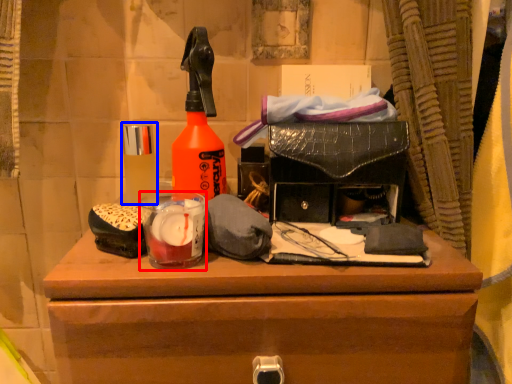
Question: Among these objects, which one is nearest to the camera, beverage (highlighted by a red box) or toiletry (highlighted by a blue box)?

Choices:
 (A) beverage
 (B) toiletry

Answer: (A)